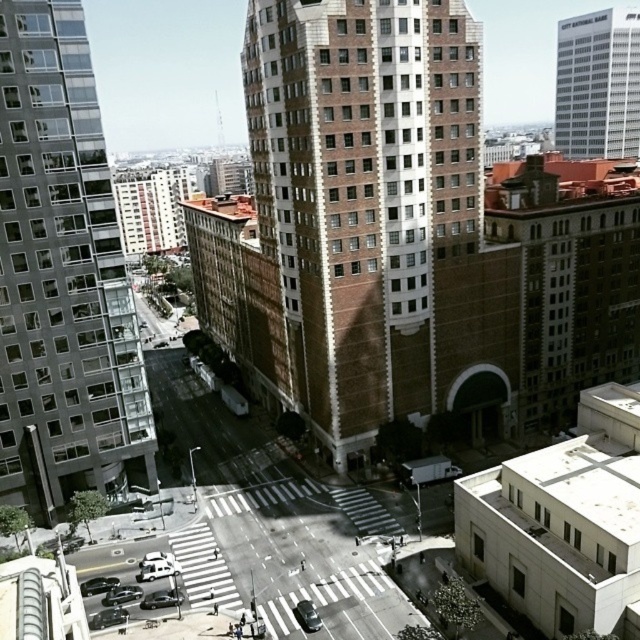
Who is lower down, brown brick building at center or glassy reflective building at left?

glassy reflective building at left is lower down.

Between point (422, 196) and point (67, 404), which one is positioned behind?

Point (422, 196)

Locate an element on the screen. This screenshot has width=640, height=640. brown brick building at center is located at coordinates (362, 193).

At what (x,y) coordinates should I click in order to perform the action: click on brown brick building at center. Please return your answer as a coordinate pair (x, y). The height and width of the screenshot is (640, 640). Looking at the image, I should click on (362, 193).

How distant is brown brick building at center from white glass skyscraper at upper right?

They are 197.81 meters apart.

Does brown brick building at center have a greater width compared to white glass skyscraper at upper right?

No, brown brick building at center is not wider than white glass skyscraper at upper right.

Is point (314, 70) closer to camera compared to point (605, 88)?

That is True.

The height and width of the screenshot is (640, 640). In order to click on brown brick building at center in this screenshot , I will do `click(362, 193)`.

Between glassy reflective building at left and white glass skyscraper at upper right, which one appears on the right side from the viewer's perspective?

From the viewer's perspective, white glass skyscraper at upper right appears more on the right side.

Describe the element at coordinates (61, 280) in the screenshot. I see `glassy reflective building at left` at that location.

The image size is (640, 640). I want to click on glassy reflective building at left, so click(61, 280).